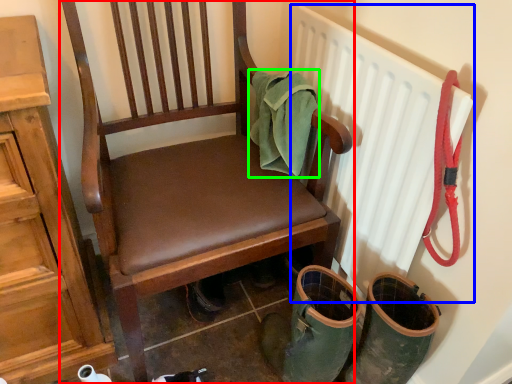
Question: Considering the real-world distances, which object is closest to chair (highlighted by a red box)? radiator (highlighted by a blue box) or material (highlighted by a green box).

Choices:
 (A) radiator
 (B) material

Answer: (B)